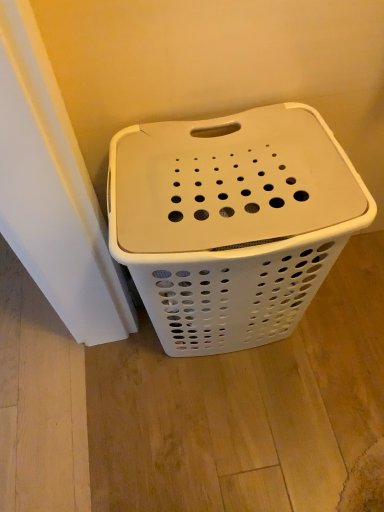
This screenshot has height=512, width=384. I want to click on vacant area to the right of white plastic laundry basket at center, so (345, 328).